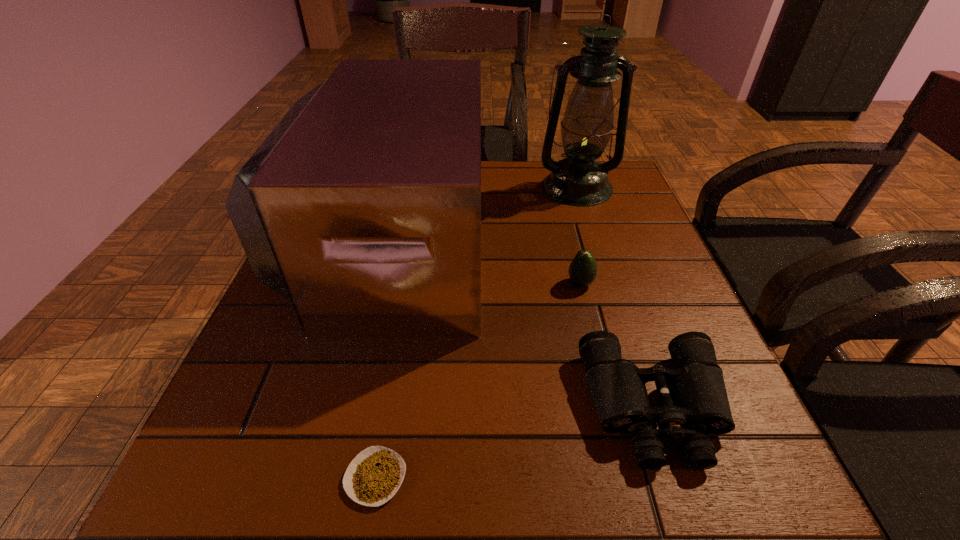
Locate an element on the screen. The width and height of the screenshot is (960, 540). free space at the near edge of the desktop is located at coordinates (496, 470).

Locate an element on the screen. free region at the left edge of the desktop is located at coordinates (285, 299).

I want to click on free space at the right edge, so click(x=625, y=214).

What are the coordinates of `vacant space at the near left corner of the desktop` in the screenshot? It's located at (221, 497).

Image resolution: width=960 pixels, height=540 pixels. Find the location of `free spot at the far right corner of the desktop`. free spot at the far right corner of the desktop is located at coordinates (612, 173).

At what (x,y) coordinates should I click in order to perform the action: click on vacant space that is in between the avocado and the microwave oven. Please return your answer as a coordinate pair (x, y). The image size is (960, 540). Looking at the image, I should click on (486, 264).

Locate an element on the screen. The width and height of the screenshot is (960, 540). empty location between the avocado and the shortest object is located at coordinates (478, 381).

The image size is (960, 540). I want to click on vacant area between the avocado and the oil lamp, so click(579, 235).

Identify the location of free space between the second tallest object and the legume. (383, 360).

Identify the location of vacant space that is in between the binoculars and the oil lamp. This screenshot has width=960, height=540. (616, 298).